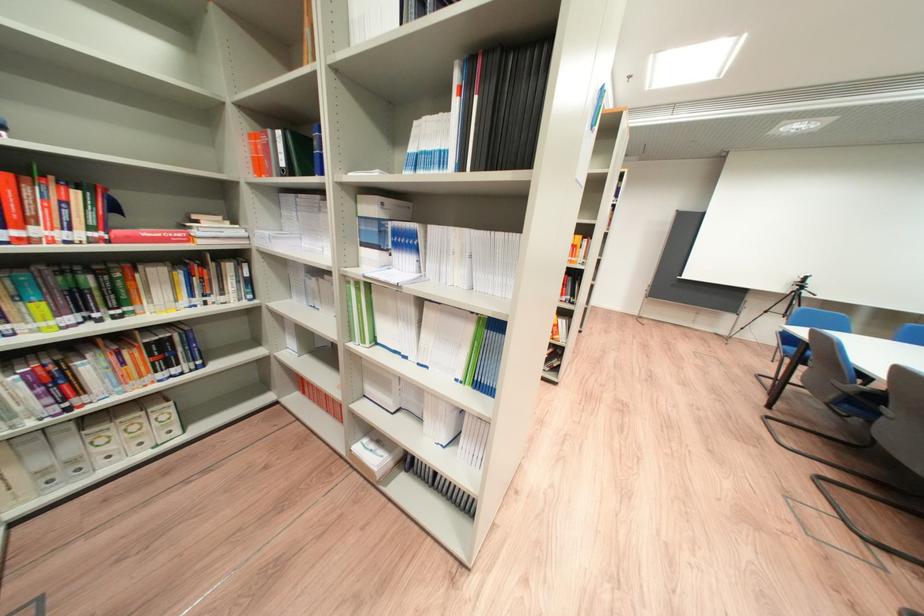
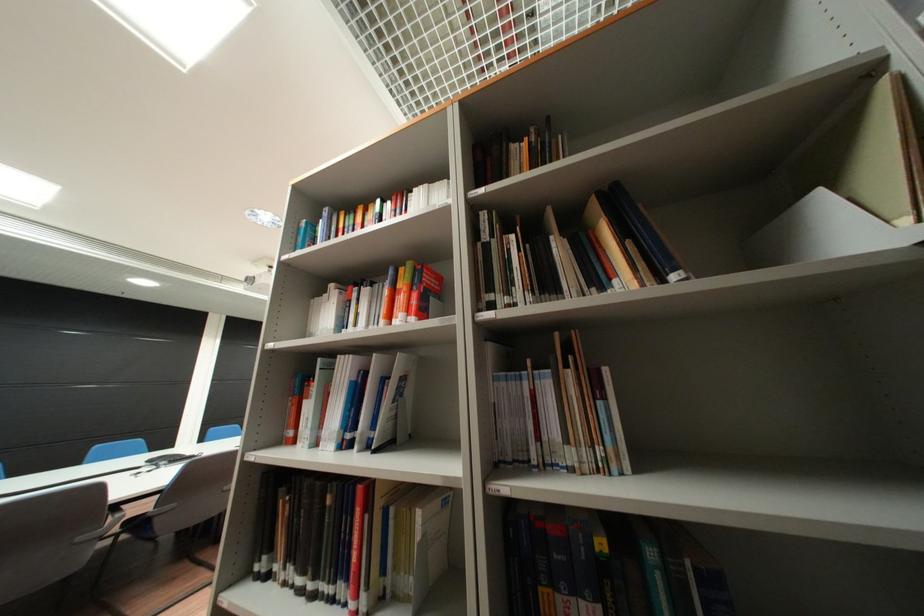
Question: I am providing you with two images of the same scene from different viewpoints. Please identify which objects are invisible in image2.

Choices:
 (A) small white box
 (B) red pouf lid
 (C) white bookend
 (D) book

Answer: (A)